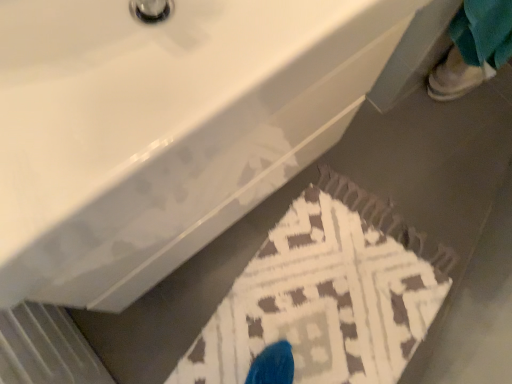
This screenshot has height=384, width=512. In order to click on free spot above brown textured rug at lower center (from a real-world perspective) in this screenshot , I will do `click(337, 291)`.